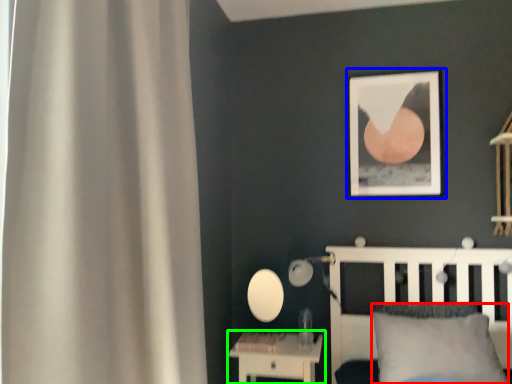
Question: Which object is positioned farthest from pillow (highlighted by a red box)? Select from picture frame (highlighted by a blue box) and nightstand (highlighted by a green box).

Choices:
 (A) picture frame
 (B) nightstand

Answer: (A)